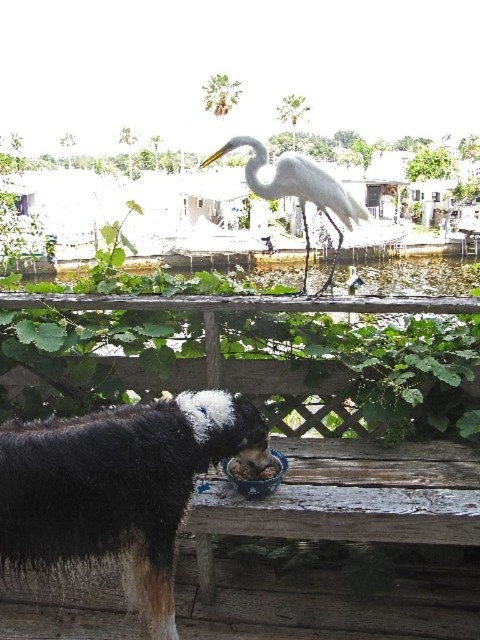
You are standing in the outdoor scene and want to walk from the black fur dog at center to the white matte bird at center. Which direction should you go?

You should walk to the right to go from the black fur dog at center to the white matte bird at center since the black fur dog at center is to the left of the white matte bird at center.

You are standing in the scene and want to toss a small pebble to the white matte bird at center. Given that you can throw a pebble up to 3 meters, will you be able to reach the bird?

The white matte bird at center is 3.77 meters away from the viewer. Since your throwing range is only 3 meters, you cannot reach the bird with a pebble.